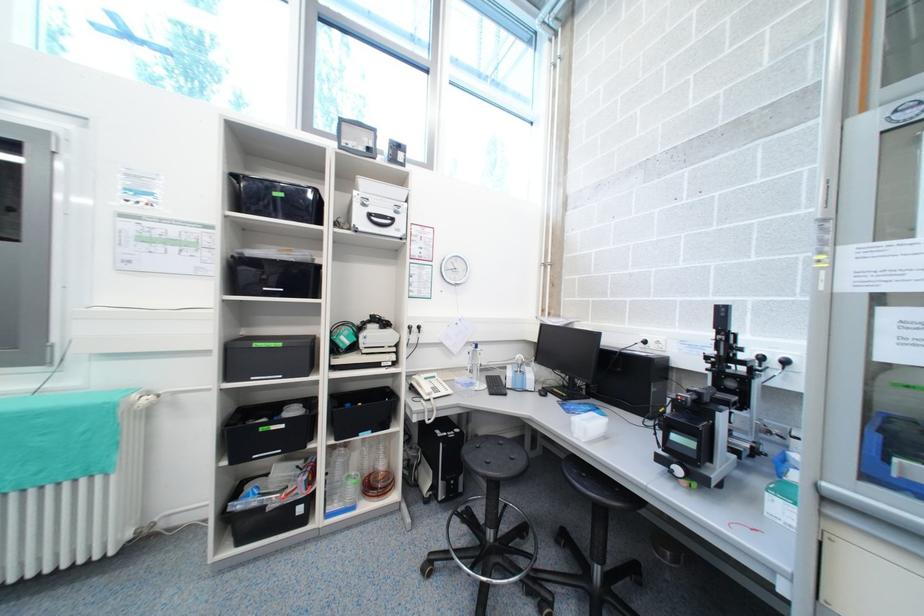
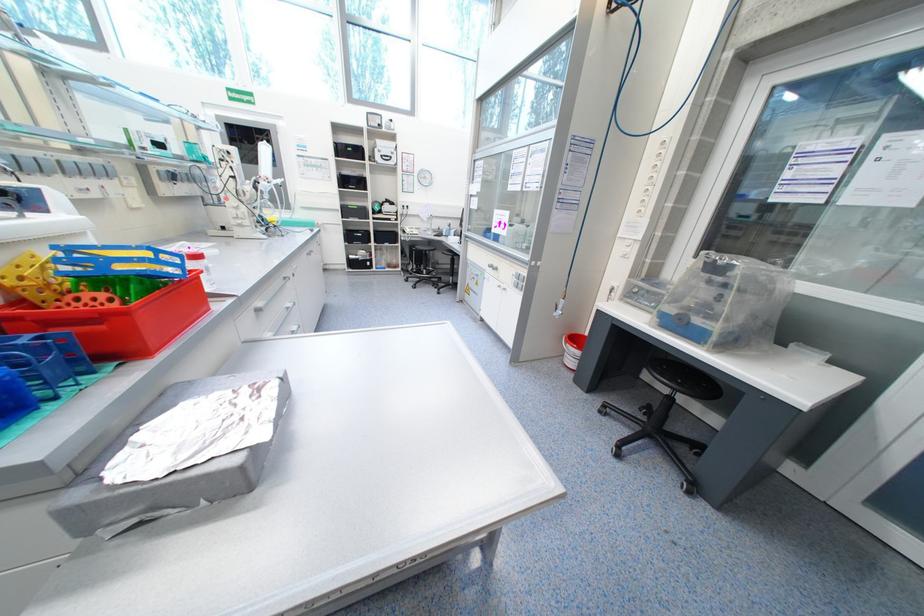
What movement of the cameraman would produce the second image?

The movement direction of the cameraman is right, backward.